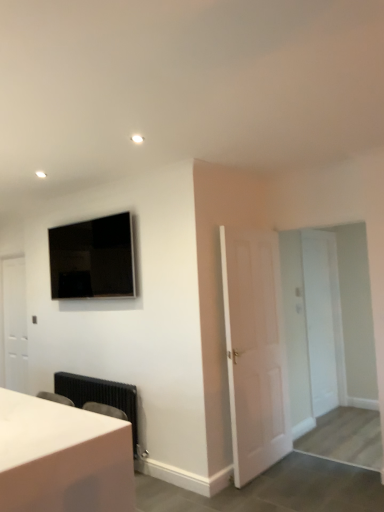
Question: Considering the relative sizes of flat screen tv at upper left and white matte door at center, the 2th door viewed from the left, in the image provided, is flat screen tv at upper left wider than white matte door at center, the 2th door viewed from the left,?

Choices:
 (A) yes
 (B) no

Answer: (A)

Question: Considering the relative sizes of flat screen tv at upper left and white matte door at center, the 2th door positioned from the right, in the image provided, is flat screen tv at upper left bigger than white matte door at center, the 2th door positioned from the right,?

Choices:
 (A) yes
 (B) no

Answer: (B)

Question: Does flat screen tv at upper left have a lesser height compared to white matte door at center, placed as the 3th door when sorted from back to front?

Choices:
 (A) no
 (B) yes

Answer: (B)

Question: Considering the relative sizes of flat screen tv at upper left and white matte door at center, placed as the 3th door when sorted from back to front, in the image provided, is flat screen tv at upper left taller than white matte door at center, placed as the 3th door when sorted from back to front,?

Choices:
 (A) yes
 (B) no

Answer: (B)

Question: Does flat screen tv at upper left appear on the left side of white matte door at center, the 2th door positioned from the right?

Choices:
 (A) yes
 (B) no

Answer: (A)

Question: From the image's perspective, is flat screen tv at upper left above white matte door at center, marked as the first door in a front-to-back arrangement?

Choices:
 (A) no
 (B) yes

Answer: (B)

Question: Is white matte door at left, arranged as the 3th door when viewed from the front, outside white matte door at center, marked as the first door in a front-to-back arrangement?

Choices:
 (A) yes
 (B) no

Answer: (A)

Question: Is white matte door at left, placed as the 3th door when sorted from right to left, smaller than white matte door at center, placed as the 3th door when sorted from back to front?

Choices:
 (A) no
 (B) yes

Answer: (A)

Question: Does white matte door at left, which ranks as the first door in back-to-front order, have a lesser height compared to white matte door at center, placed as the 3th door when sorted from back to front?

Choices:
 (A) yes
 (B) no

Answer: (A)

Question: Could you tell me if white matte door at left, which ranks as the first door in back-to-front order, is turned towards white matte door at center, placed as the 3th door when sorted from back to front?

Choices:
 (A) no
 (B) yes

Answer: (A)

Question: From a real-world perspective, is white matte door at left, which is the first door from left to right, beneath white matte door at center, the 2th door viewed from the left?

Choices:
 (A) no
 (B) yes

Answer: (A)

Question: Can you confirm if flat screen tv at upper left is thinner than white matte door at center, acting as the 2th door starting from the front?

Choices:
 (A) no
 (B) yes

Answer: (A)